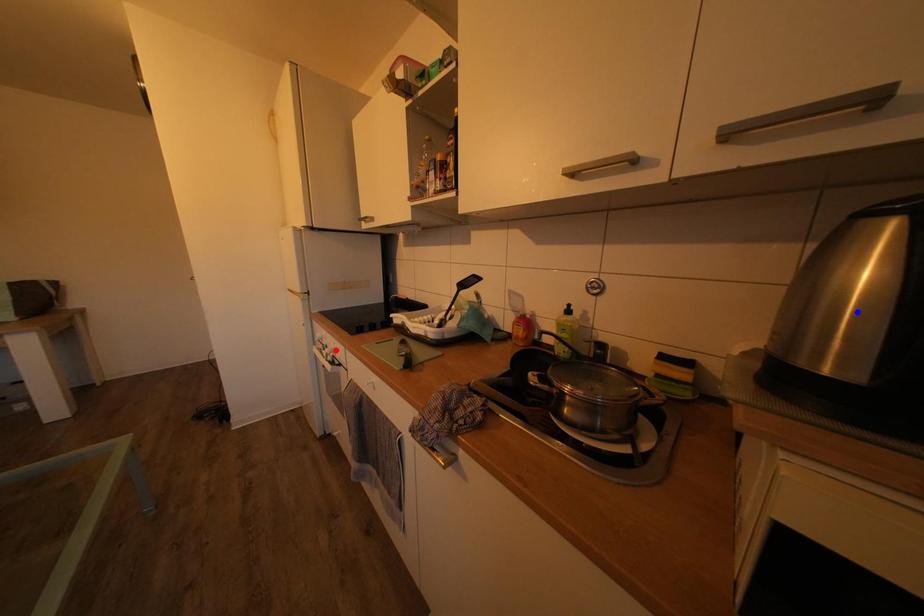
Question: In the image, two points are highlighted. Which point is nearer to the camera? Reply with the corresponding letter.

Choices:
 (A) blue point
 (B) red point

Answer: (A)